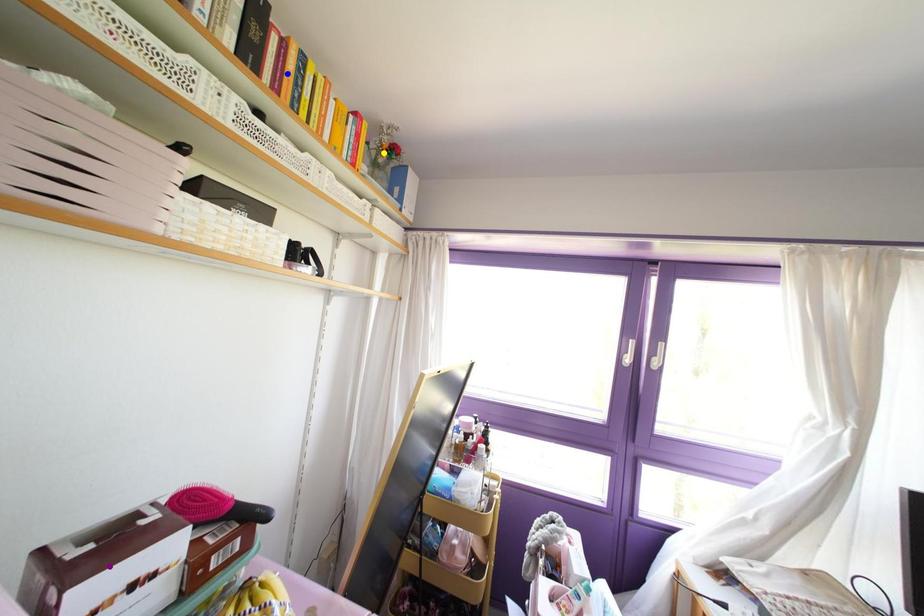
Order these from nearest to farthest:
A) purple point
B) yellow point
C) blue point

yellow point → blue point → purple point